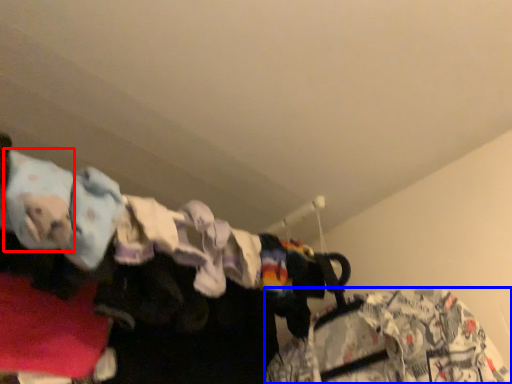
Question: Which of the following is the farthest to the observer, clothing (highlighted by a red box) or clothing (highlighted by a blue box)?

Choices:
 (A) clothing
 (B) clothing

Answer: (B)